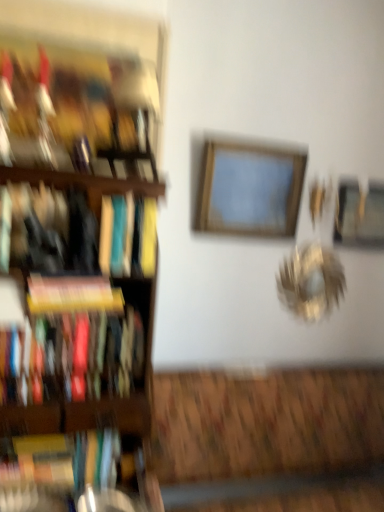
Question: Is hardcover book at left, acting as the first book starting from the bottom, turned away from wooden frame at center, which is the 2th picture frame from back to front?

Choices:
 (A) yes
 (B) no

Answer: (B)

Question: Is hardcover book at left, acting as the first book starting from the bottom, smaller than wooden frame at center, which is the 2th picture frame from back to front?

Choices:
 (A) no
 (B) yes

Answer: (B)

Question: Is hardcover book at left, positioned as the fifth book in top-to-bottom order, shorter than wooden frame at center, which is the 2th picture frame from back to front?

Choices:
 (A) yes
 (B) no

Answer: (A)

Question: Does hardcover book at left, acting as the first book starting from the bottom, have a larger size compared to wooden frame at center, placed as the second picture frame when sorted from right to left?

Choices:
 (A) no
 (B) yes

Answer: (A)

Question: From a real-world perspective, does hardcover book at left, positioned as the fifth book in top-to-bottom order, stand above wooden frame at center, the 1th picture frame in the front-to-back sequence?

Choices:
 (A) yes
 (B) no

Answer: (B)

Question: Considering their positions, is wooden frame at center, placed as the second picture frame when sorted from right to left, located in front of or behind wooden bookshelf at left?

Choices:
 (A) behind
 (B) front

Answer: (A)

Question: In terms of height, does wooden frame at center, which is the 2th picture frame from back to front, look taller or shorter compared to wooden bookshelf at left?

Choices:
 (A) short
 (B) tall

Answer: (A)

Question: Would you say wooden frame at center, the first picture frame in the left-to-right sequence, is inside or outside wooden bookshelf at left?

Choices:
 (A) inside
 (B) outside

Answer: (B)

Question: From a real-world perspective, is wooden frame at center, the first picture frame in the left-to-right sequence, physically located above or below wooden bookshelf at left?

Choices:
 (A) below
 (B) above

Answer: (B)

Question: Would you say hardcover book at left, positioned as the fifth book in top-to-bottom order, is inside or outside metallic gold picture frame at upper right, placed as the second picture frame when sorted from front to back?

Choices:
 (A) outside
 (B) inside

Answer: (A)

Question: Considering the positions of point (66, 482) and point (372, 228), is point (66, 482) closer or farther from the camera than point (372, 228)?

Choices:
 (A) farther
 (B) closer

Answer: (B)

Question: Is hardcover book at left, positioned as the fifth book in top-to-bottom order, in front of or behind metallic gold picture frame at upper right, the second picture frame when ordered from left to right, in the image?

Choices:
 (A) front
 (B) behind

Answer: (A)

Question: From a real-world perspective, is hardcover book at left, acting as the first book starting from the bottom, above or below metallic gold picture frame at upper right, the 1th picture frame from the right?

Choices:
 (A) below
 (B) above

Answer: (A)

Question: Is point (44, 305) closer or farther from the camera than point (271, 180)?

Choices:
 (A) closer
 (B) farther

Answer: (A)

Question: From a real-world perspective, is yellow matte book at left, acting as the third book starting from the bottom, physically located above or below wooden frame at center, the first picture frame in the left-to-right sequence?

Choices:
 (A) below
 (B) above

Answer: (A)